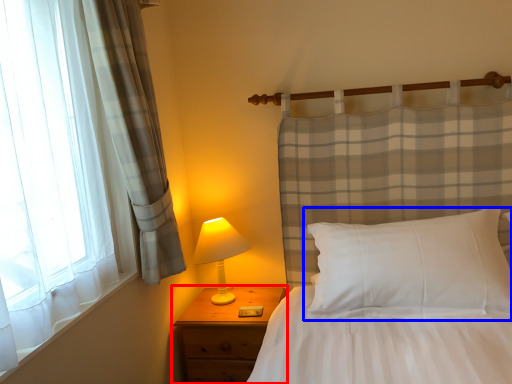
Question: Among these objects, which one is nearest to the camera, nightstand (highlighted by a red box) or pillow (highlighted by a blue box)?

Choices:
 (A) nightstand
 (B) pillow

Answer: (B)